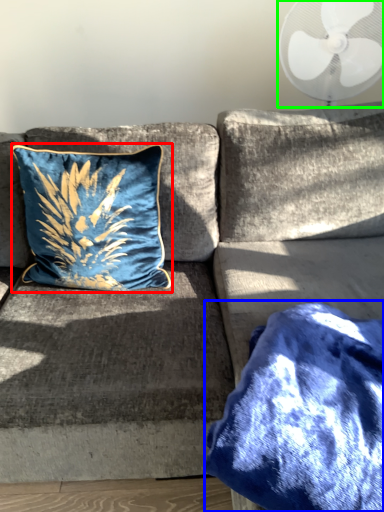
Question: Which is nearer to the pillow (highlighted by a red box)? blanket (highlighted by a blue box) or mechanical fan (highlighted by a green box).

Choices:
 (A) blanket
 (B) mechanical fan

Answer: (A)